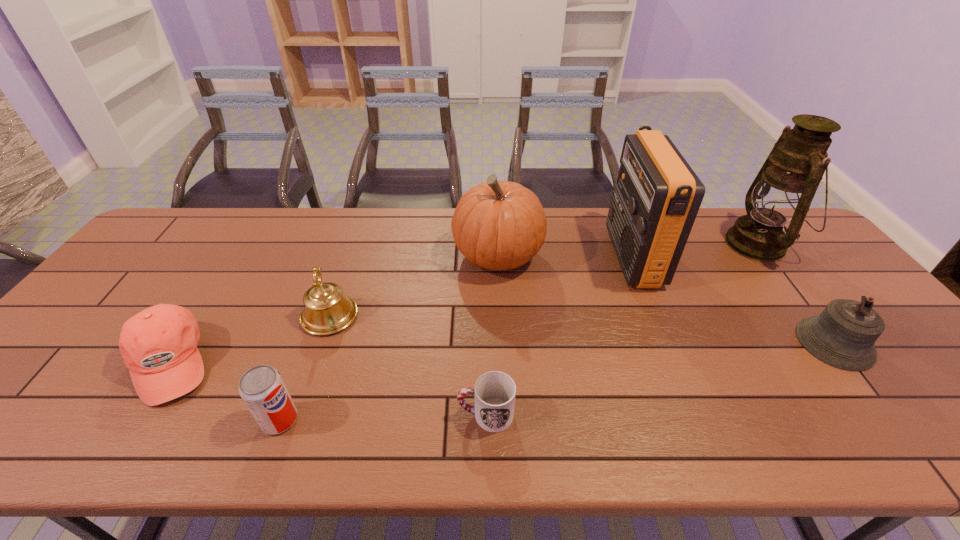
At what (x,y) coordinates should I click in order to perform the action: click on vacant space situated 0.350m on the side of the cup where the handle is located. Please return your answer as a coordinate pair (x, y). Image resolution: width=960 pixels, height=540 pixels. Looking at the image, I should click on (296, 414).

I want to click on vacant area located on the side of the cup where the handle is located, so click(x=435, y=414).

At what (x,y) coordinates should I click in order to perform the action: click on vacant space located 0.390m on the side of the cup where the handle is located. Please return your answer as a coordinate pair (x, y). Looking at the image, I should click on (277, 414).

In order to click on oil lamp that is at the far edge in this screenshot , I will do `click(784, 188)`.

Find the location of a particular element. The height and width of the screenshot is (540, 960). radio receiver that is at the far edge is located at coordinates coord(654,204).

The image size is (960, 540). In order to click on pumpkin that is at the far edge in this screenshot , I will do `click(498, 225)`.

Image resolution: width=960 pixels, height=540 pixels. In order to click on soda present at the near edge in this screenshot , I will do `click(262, 388)`.

The width and height of the screenshot is (960, 540). Identify the location of cup at the near edge. (494, 392).

This screenshot has height=540, width=960. Find the location of `oil lamp located at the right edge`. oil lamp located at the right edge is located at coordinates (784, 188).

Locate an element on the screen. Image resolution: width=960 pixels, height=540 pixels. bell situated at the right edge is located at coordinates (843, 335).